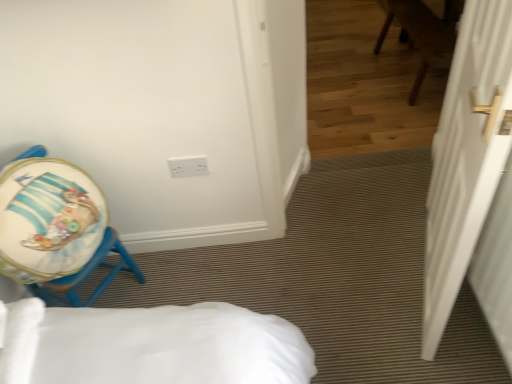
This screenshot has width=512, height=384. Identify the location of white matte door at right. (466, 157).

Find the location of a particular element. The width and height of the screenshot is (512, 384). matte blue stool at left is located at coordinates (55, 227).

Find the location of a particular element. The height and width of the screenshot is (384, 512). white plastic electric outlet at upper center is located at coordinates (188, 166).

Locate an element on the screen. white matte door at right is located at coordinates (466, 157).

Which of these two, matte blue stool at left or white matte door at right, is bigger?

white matte door at right.

Can you confirm if matte blue stool at left is positioned to the left of white matte door at right?

Yes.

Is the surface of matte blue stool at left in direct contact with white matte door at right?

No, matte blue stool at left is not in contact with white matte door at right.

From a real-world perspective, is matte blue stool at left above or below white matte door at right?

In terms of real-world spatial position, matte blue stool at left is below white matte door at right.

Consider the image. Considering the relative positions of white matte door at right and white plastic electric outlet at upper center in the image provided, is white matte door at right behind white plastic electric outlet at upper center?

That is False.

Does white matte door at right turn towards white plastic electric outlet at upper center?

Yes, white matte door at right is facing white plastic electric outlet at upper center.

I want to click on door above the white plastic electric outlet at upper center (from a real-world perspective), so click(466, 157).

Is white matte door at right next to white plastic electric outlet at upper center and touching it?

No, white matte door at right is not touching white plastic electric outlet at upper center.

Does matte blue stool at left have a lesser height compared to white plastic electric outlet at upper center?

In fact, matte blue stool at left may be taller than white plastic electric outlet at upper center.

From a real-world perspective, which is physically below, matte blue stool at left or white plastic electric outlet at upper center?

white plastic electric outlet at upper center is physically lower.

Which is correct: matte blue stool at left is inside white plastic electric outlet at upper center, or outside of it?

matte blue stool at left is not inside white plastic electric outlet at upper center, it's outside.

Does white matte door at right turn towards matte blue stool at left?

Yes, white matte door at right is oriented towards matte blue stool at left.

Is point (456, 125) closer to viewer compared to point (10, 240)?

No, it is behind (10, 240).

Can you confirm if white matte door at right is shorter than matte blue stool at left?

No, white matte door at right is not shorter than matte blue stool at left.

Can you tell me how much white plastic electric outlet at upper center and white matte door at right differ in facing direction?

The facing directions of white plastic electric outlet at upper center and white matte door at right are 109 degrees apart.

Considering the positions of points (187, 172) and (479, 186), is point (187, 172) closer to camera compared to point (479, 186)?

No, it is not.

From the image's perspective, is white plastic electric outlet at upper center positioned above or below white matte door at right?

From the image's perspective, white plastic electric outlet at upper center appears above white matte door at right.

Can you confirm if white plastic electric outlet at upper center is positioned to the right of white matte door at right?

No, white plastic electric outlet at upper center is not to the right of white matte door at right.

Is white plastic electric outlet at upper center to the right of matte blue stool at left from the viewer's perspective?

Correct, you'll find white plastic electric outlet at upper center to the right of matte blue stool at left.

In terms of width, does white plastic electric outlet at upper center look wider or thinner when compared to matte blue stool at left?

In the image, white plastic electric outlet at upper center appears to be more narrow than matte blue stool at left.

From the image's perspective, is white plastic electric outlet at upper center below matte blue stool at left?

Actually, white plastic electric outlet at upper center appears above matte blue stool at left in the image.

Can you confirm if white plastic electric outlet at upper center is shorter than matte blue stool at left?

Correct, white plastic electric outlet at upper center is not as tall as matte blue stool at left.

The width and height of the screenshot is (512, 384). In the image, there is a white matte door at right. Identify the location of chair below it (from a real-world perspective). (55, 227).

Where is `electric outlet that is on the left side of white matte door at right`? Image resolution: width=512 pixels, height=384 pixels. electric outlet that is on the left side of white matte door at right is located at coordinates (188, 166).

When comparing their distances from white matte door at right, does matte blue stool at left or white plastic electric outlet at upper center seem further?

matte blue stool at left.

In the scene shown: Estimate the real-world distances between objects in this image. Which object is closer to matte blue stool at left, white matte door at right or white plastic electric outlet at upper center?

Among the two, white plastic electric outlet at upper center is located nearer to matte blue stool at left.

Considering their positions, is matte blue stool at left positioned further to white plastic electric outlet at upper center than white matte door at right?

white matte door at right is further to white plastic electric outlet at upper center.

Looking at the image, which one is located closer to white matte door at right, white plastic electric outlet at upper center or matte blue stool at left?

white plastic electric outlet at upper center is positioned closer to the anchor white matte door at right.

Looking at the image, which one is located further to white plastic electric outlet at upper center, white matte door at right or matte blue stool at left?

white matte door at right is further to white plastic electric outlet at upper center.

Considering their positions, is white plastic electric outlet at upper center positioned closer to matte blue stool at left than white matte door at right?

Among the two, white plastic electric outlet at upper center is located nearer to matte blue stool at left.

Locate an element on the screen. The width and height of the screenshot is (512, 384). electric outlet situated between matte blue stool at left and white matte door at right from left to right is located at coordinates click(188, 166).